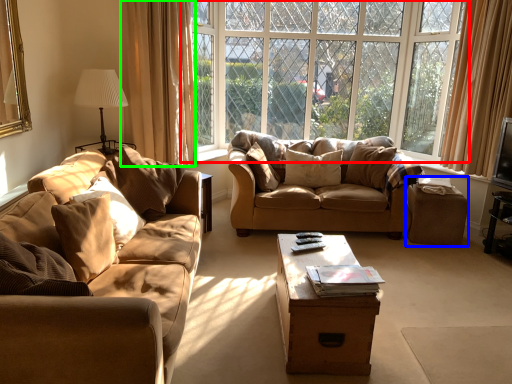
Question: Which object is positioned closest to window (highlighted by a red box)? Select from stool (highlighted by a blue box) and curtain (highlighted by a green box).

Choices:
 (A) stool
 (B) curtain

Answer: (B)